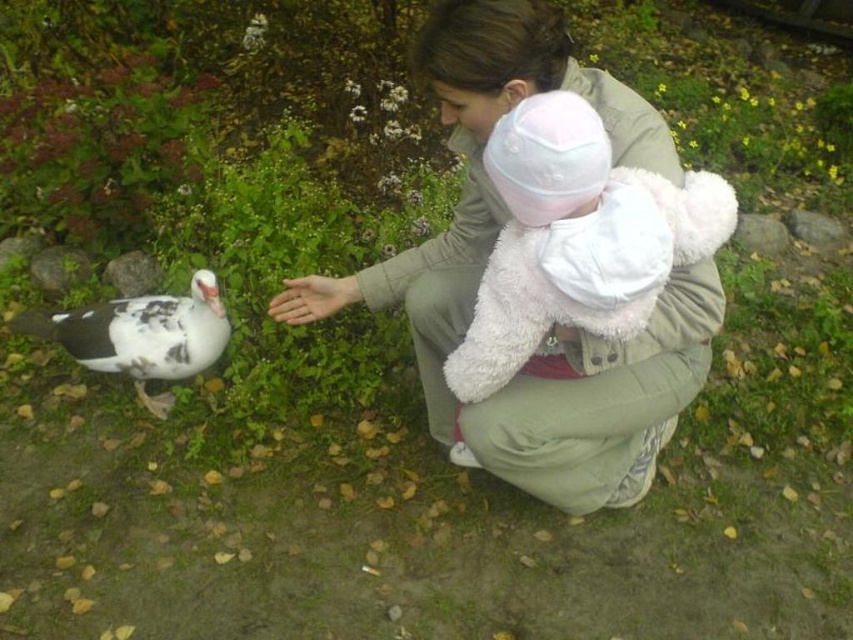
Identify the location of light beige fleece jacket at center. (486, 259).

Does light beige fleece jacket at center appear over white speckled feather at lower left?

Correct, light beige fleece jacket at center is located above white speckled feather at lower left.

The height and width of the screenshot is (640, 853). Identify the location of light beige fleece jacket at center. (486, 259).

Where is `light beige fleece jacket at center`? Image resolution: width=853 pixels, height=640 pixels. light beige fleece jacket at center is located at coordinates (486, 259).

Which is in front, point (706, 248) or point (183, 371)?

Point (706, 248)

Does white plush hat at upper center appear over white speckled feather at lower left?

Indeed, white plush hat at upper center is positioned over white speckled feather at lower left.

Between point (492, 296) and point (120, 346), which one is positioned in front?

Point (492, 296) is in front.

This screenshot has width=853, height=640. I want to click on white plush hat at upper center, so click(576, 240).

Between light beige fleece jacket at center and white plush hat at upper center, which one appears on the right side from the viewer's perspective?

From the viewer's perspective, white plush hat at upper center appears more on the right side.

Between light beige fleece jacket at center and white plush hat at upper center, which one is positioned higher?

Positioned higher is white plush hat at upper center.

Measure the distance between light beige fleece jacket at center and camera.

The distance of light beige fleece jacket at center from camera is 1.58 meters.

The height and width of the screenshot is (640, 853). What are the coordinates of `light beige fleece jacket at center` in the screenshot? It's located at (486, 259).